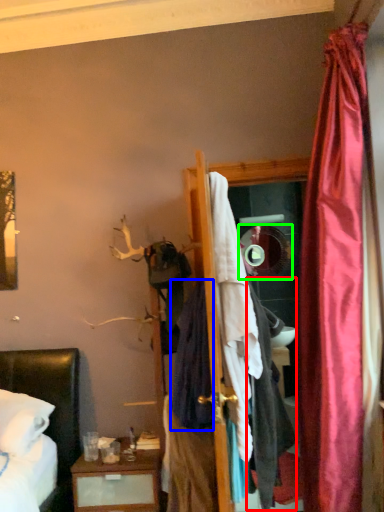
Question: Based on their relative distances, which object is nearer to clothing (highlighted by a red box)? Choose from clothing (highlighted by a blue box) and mirror (highlighted by a green box).

Choices:
 (A) clothing
 (B) mirror

Answer: (A)